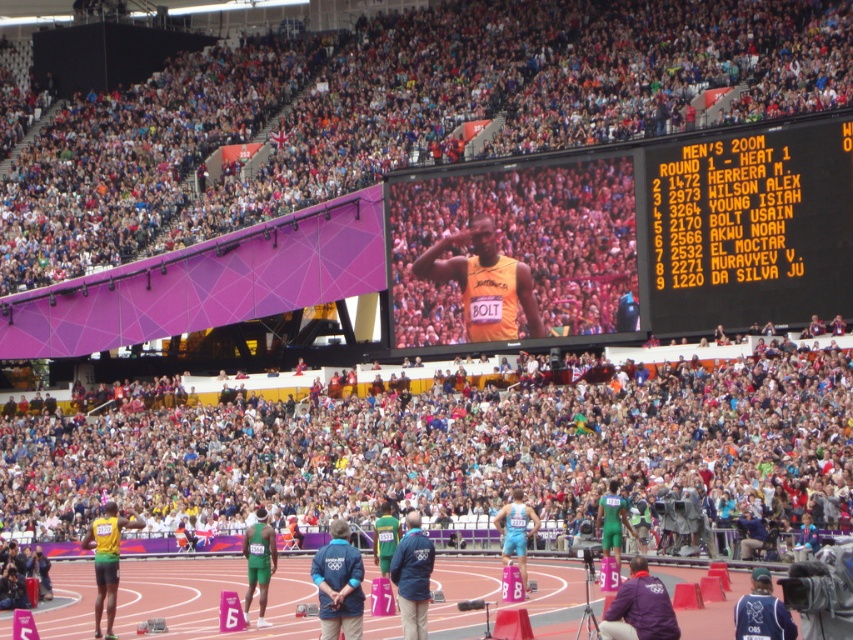
Who is more distant from viewer, (717, 147) or (256, 561)?

Point (717, 147)

Is black plastic scoreboard at upper right further to camera compared to green fabric shorts at center?

Yes.

Measure the distance between black plastic scoreboard at upper right and camera.

black plastic scoreboard at upper right is 77.48 meters away from camera.

The image size is (853, 640). I want to click on black plastic scoreboard at upper right, so click(746, 227).

Locate an element on the screen. This screenshot has height=640, width=853. white crowd at center is located at coordinates (445, 449).

In the scene shown: Which is more to the right, white crowd at center or dark blue jersey at lower right?

dark blue jersey at lower right is more to the right.

Does point (170, 410) lie in front of point (761, 586)?

No, (170, 410) is behind (761, 586).

Image resolution: width=853 pixels, height=640 pixels. Identify the location of white crowd at center. (445, 449).

Is blue fleece jacket at center below light blue fabric shorts at center?

Yes.

Which is more to the right, blue fleece jacket at center or light blue fabric shorts at center?

Positioned to the right is light blue fabric shorts at center.

The image size is (853, 640). What do you see at coordinates (338, 584) in the screenshot?
I see `blue fleece jacket at center` at bounding box center [338, 584].

The width and height of the screenshot is (853, 640). What are the coordinates of `blue fleece jacket at center` in the screenshot? It's located at (x=338, y=584).